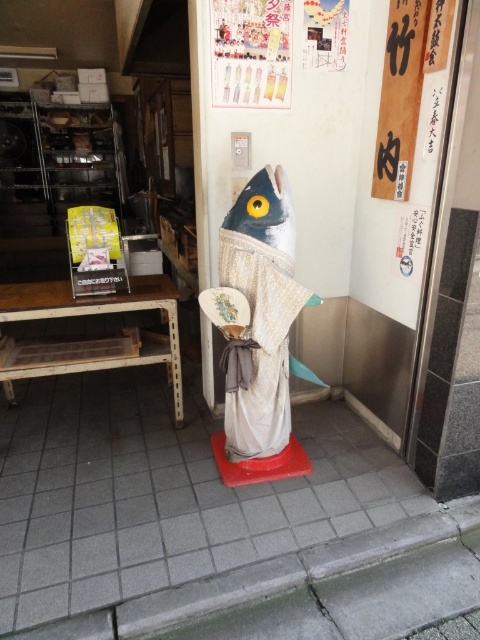
From the picture: You are a delivery person trying to place a large box in the entrance area. The box is 1.2 meters wide. There is space between the matte white fish at center and the wooden sign at upper right. Can the box fit in that space?

The matte white fish at center might be wider than wooden sign at upper right, so the space between them may not be wide enough for the 1.2 meter box. Check the exact dimensions before placing the box.

You are a delivery person carrying a large package that requires a flat surface to place. Given the scene described, which object between the gray tile pavement at center and the wooden sign at upper right would be more suitable for placing your package?

The gray tile pavement at center is larger in size than the wooden sign at upper right, so it would be more suitable for placing the large package as it provides a bigger and flatter surface area.